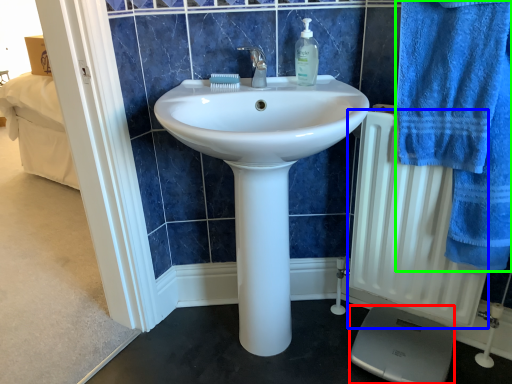
Question: Considering the real-world distances, which object is farthest from scale (highlighted by a red box)? radiator (highlighted by a blue box) or bath towel (highlighted by a green box)?

Choices:
 (A) radiator
 (B) bath towel

Answer: (B)